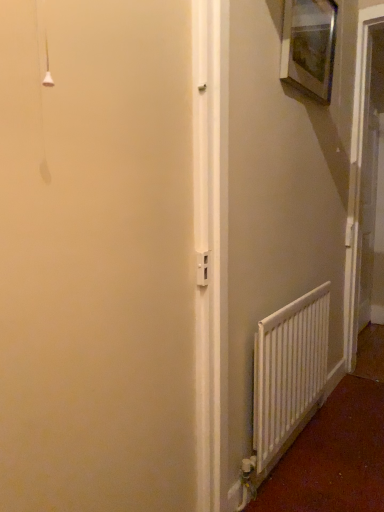
Question: From the image's perspective, relative to white matte radiator at lower right, is white plastic screen door at right above or below?

Choices:
 (A) below
 (B) above

Answer: (B)

Question: Is point (375, 19) positioned closer to the camera than point (256, 333)?

Choices:
 (A) farther
 (B) closer

Answer: (A)

Question: Considering the real-world distances, which object is farthest from the white plastic screen door at right?

Choices:
 (A) wooden picture frame at upper right
 (B) white matte radiator at lower right

Answer: (B)

Question: Which object is positioned farthest from the white matte radiator at lower right?

Choices:
 (A) white plastic screen door at right
 (B) wooden picture frame at upper right

Answer: (B)